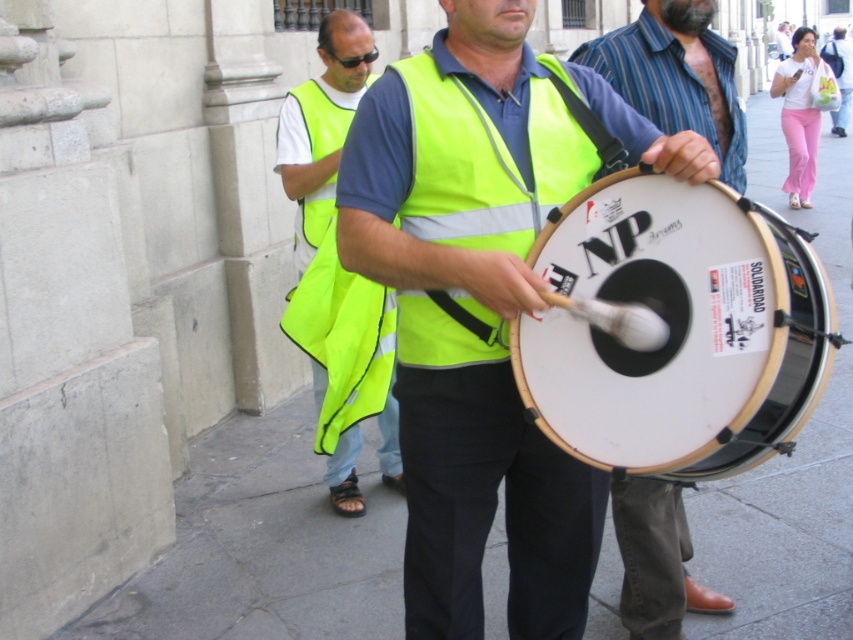
Question: Can you confirm if high-visibility fabric safety vest at center is positioned below matte yellow vest at center?

Choices:
 (A) yes
 (B) no

Answer: (B)

Question: Is high-visibility fabric safety vest at center thinner than high visibility fabric safety vest at center?

Choices:
 (A) no
 (B) yes

Answer: (A)

Question: Estimate the real-world distances between objects in this image. Which object is closer to the yellow reflective vest at center?

Choices:
 (A) high visibility fabric safety vest at center
 (B) black plastic goggles at center
 (C) matte yellow vest at center

Answer: (C)

Question: Does high-visibility fabric safety vest at center have a larger size compared to neon yellow vest at center?

Choices:
 (A) no
 (B) yes

Answer: (B)

Question: Among these points, which one is farthest from the camera?

Choices:
 (A) (317, 204)
 (B) (495, 173)
 (C) (627, 42)
 (D) (505, 436)

Answer: (A)

Question: Which point is closer to the camera?

Choices:
 (A) neon yellow vest at center
 (B) high-visibility fabric safety vest at center

Answer: (B)